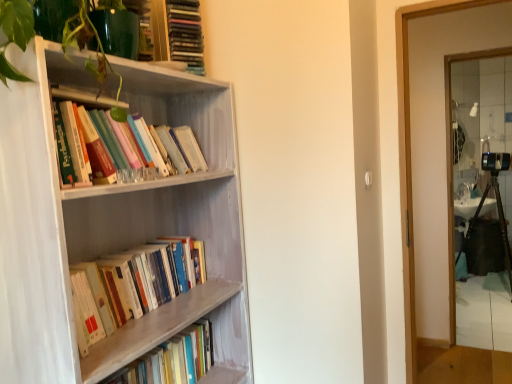
In order to face wooden bookshelf at left, marked as the 2th book in a bottom-to-top arrangement, should I rotate leftwards or rightwards?

Turn left by 15.346 degrees to look at wooden bookshelf at left, marked as the 2th book in a bottom-to-top arrangement.

This screenshot has width=512, height=384. I want to click on wooden bookshelf at left, marked as the 2th book in a bottom-to-top arrangement, so click(143, 279).

The height and width of the screenshot is (384, 512). Describe the element at coordinates (482, 196) in the screenshot. I see `clear glass mirror at right` at that location.

In order to face clear glass mirror at right, should I rotate leftwards or rightwards?

It's best to rotate right around 28.938 degrees.

Identify the location of wooden book at left, which is the 1th book from bottom to top. This screenshot has width=512, height=384. (172, 359).

This screenshot has height=384, width=512. What do you see at coordinates (136, 143) in the screenshot?
I see `hardcover books at upper left, which is the 3th book in bottom-to-top order` at bounding box center [136, 143].

This screenshot has height=384, width=512. Identify the location of matte plastic books at upper center, acting as the 4th book starting from the bottom. (185, 34).

The width and height of the screenshot is (512, 384). Identify the location of wooden bookshelf at left, marked as the 3th book in a top-to-bottom arrangement. (143, 279).

Can you confirm if wooden bookcase at left is wider than clear glass mirror at right?

Indeed, wooden bookcase at left has a greater width compared to clear glass mirror at right.

Is wooden bookcase at left taller than clear glass mirror at right?

In fact, wooden bookcase at left may be shorter than clear glass mirror at right.

Consider the image. Is wooden bookcase at left at the left side of clear glass mirror at right?

Correct, you'll find wooden bookcase at left to the left of clear glass mirror at right.

Does wooden bookcase at left contain clear glass mirror at right?

No, clear glass mirror at right is not inside wooden bookcase at left.

In terms of height, does matte plastic books at upper center, acting as the 4th book starting from the bottom, look taller or shorter compared to wooden bookshelf at left, marked as the 3th book in a top-to-bottom arrangement?

Considering their sizes, matte plastic books at upper center, acting as the 4th book starting from the bottom, has more height than wooden bookshelf at left, marked as the 3th book in a top-to-bottom arrangement.

Locate an element on the screen. The height and width of the screenshot is (384, 512). the 2nd book located above the wooden bookshelf at left, marked as the 2th book in a bottom-to-top arrangement (from a real-world perspective) is located at coordinates (185, 34).

Considering the positions of objects matte plastic books at upper center, acting as the 4th book starting from the bottom, and wooden bookshelf at left, marked as the 2th book in a bottom-to-top arrangement, in the image provided, who is in front, matte plastic books at upper center, acting as the 4th book starting from the bottom, or wooden bookshelf at left, marked as the 2th book in a bottom-to-top arrangement,?

wooden bookshelf at left, marked as the 2th book in a bottom-to-top arrangement.

How different are the orientations of matte plastic books at upper center, the 1th book viewed from the top, and wooden bookshelf at left, marked as the 2th book in a bottom-to-top arrangement, in degrees?

The facing directions of matte plastic books at upper center, the 1th book viewed from the top, and wooden bookshelf at left, marked as the 2th book in a bottom-to-top arrangement, are 28.1 degrees apart.

Which object is thinner, wooden book at left, which is the 1th book from bottom to top, or wooden bookshelf at left, marked as the 3th book in a top-to-bottom arrangement?

Thinner between the two is wooden book at left, which is the 1th book from bottom to top.

Is wooden book at left, which is the 1th book from bottom to top, bigger than wooden bookshelf at left, marked as the 3th book in a top-to-bottom arrangement?

No.

Is wooden book at left, the 4th book viewed from the top, completely or partially outside of wooden bookshelf at left, marked as the 3th book in a top-to-bottom arrangement?

wooden book at left, the 4th book viewed from the top, is positioned outside wooden bookshelf at left, marked as the 3th book in a top-to-bottom arrangement.

Does wooden bookshelf at left, marked as the 3th book in a top-to-bottom arrangement, appear on the right side of matte plastic books at upper center, the 1th book viewed from the top?

No.

Consider the image. Is wooden bookshelf at left, marked as the 3th book in a top-to-bottom arrangement, facing away from matte plastic books at upper center, the 1th book viewed from the top?

wooden bookshelf at left, marked as the 3th book in a top-to-bottom arrangement, is not turned away from matte plastic books at upper center, the 1th book viewed from the top.

How many degrees apart are the facing directions of wooden bookshelf at left, marked as the 2th book in a bottom-to-top arrangement, and matte plastic books at upper center, the 1th book viewed from the top?

28.1 degrees separate the facing orientations of wooden bookshelf at left, marked as the 2th book in a bottom-to-top arrangement, and matte plastic books at upper center, the 1th book viewed from the top.

Does point (183, 283) appear closer or farther from the camera than point (202, 62)?

Point (183, 283).

Considering the sizes of objects clear glass mirror at right and hardcover books at upper left, which is the 3th book in bottom-to-top order, in the image provided, who is bigger, clear glass mirror at right or hardcover books at upper left, which is the 3th book in bottom-to-top order,?

With larger size is clear glass mirror at right.

How many degrees apart are the facing directions of clear glass mirror at right and hardcover books at upper left, which is the second book from top to bottom?

87 degrees separate the facing orientations of clear glass mirror at right and hardcover books at upper left, which is the second book from top to bottom.

Is clear glass mirror at right turned away from hardcover books at upper left, which is the second book from top to bottom?

clear glass mirror at right is not turned away from hardcover books at upper left, which is the second book from top to bottom.

You are a GUI agent. You are given a task and a screenshot of the screen. Output one action in this format:
    pyautogui.click(x=<x>, y=<y>)
    Task: Click on the mirror behind the hardcover books at upper left, which is the second book from top to bottom
    
    Given the screenshot: What is the action you would take?
    pyautogui.click(x=482, y=196)

In the scene shown: Is wooden bookcase at left placed right next to green glossy plant at upper left?

No, wooden bookcase at left is not with green glossy plant at upper left.

Is wooden bookcase at left oriented towards green glossy plant at upper left?

No, wooden bookcase at left does not turn towards green glossy plant at upper left.

In the scene shown: Is green glossy plant at upper left inside wooden bookcase at left?

Actually, green glossy plant at upper left is outside wooden bookcase at left.

What are the coordinates of `plant in front of the wooden bookcase at left` in the screenshot? It's located at (96, 53).

Between hardcover books at upper left, which is the 3th book in bottom-to-top order, and wooden bookshelf at left, marked as the 2th book in a bottom-to-top arrangement, which one has less height?

wooden bookshelf at left, marked as the 2th book in a bottom-to-top arrangement, is shorter.

Is hardcover books at upper left, which is the second book from top to bottom, bigger than wooden bookshelf at left, marked as the 2th book in a bottom-to-top arrangement?

Correct, hardcover books at upper left, which is the second book from top to bottom, is larger in size than wooden bookshelf at left, marked as the 2th book in a bottom-to-top arrangement.

How many degrees apart are the facing directions of hardcover books at upper left, which is the 3th book in bottom-to-top order, and wooden bookshelf at left, marked as the 2th book in a bottom-to-top arrangement?

The facing directions of hardcover books at upper left, which is the 3th book in bottom-to-top order, and wooden bookshelf at left, marked as the 2th book in a bottom-to-top arrangement, are 0.000535 degrees apart.

From a real-world perspective, is hardcover books at upper left, which is the second book from top to bottom, above or below wooden bookshelf at left, marked as the 2th book in a bottom-to-top arrangement?

hardcover books at upper left, which is the second book from top to bottom, is above wooden bookshelf at left, marked as the 2th book in a bottom-to-top arrangement.

Find the location of a particular element. This screenshot has width=512, height=384. mirror on the right of wooden bookcase at left is located at coordinates (482, 196).

Where is `the 2nd book in front of the matte plastic books at upper center, acting as the 4th book starting from the bottom`? The height and width of the screenshot is (384, 512). the 2nd book in front of the matte plastic books at upper center, acting as the 4th book starting from the bottom is located at coordinates (143, 279).

Considering their positions, is wooden bookcase at left positioned closer to matte plastic books at upper center, the 1th book viewed from the top, than clear glass mirror at right?

The object closer to matte plastic books at upper center, the 1th book viewed from the top, is wooden bookcase at left.

Based on their spatial positions, is wooden bookshelf at left, marked as the 2th book in a bottom-to-top arrangement, or wooden bookcase at left closer to hardcover books at upper left, which is the second book from top to bottom?

wooden bookcase at left.

Estimate the real-world distances between objects in this image. Which object is closer to wooden bookshelf at left, marked as the 3th book in a top-to-bottom arrangement, hardcover books at upper left, which is the second book from top to bottom, or matte plastic books at upper center, the 1th book viewed from the top?

hardcover books at upper left, which is the second book from top to bottom.

Looking at the image, which one is located further to hardcover books at upper left, which is the second book from top to bottom, wooden book at left, which is the 1th book from bottom to top, or matte plastic books at upper center, the 1th book viewed from the top?

Based on the image, wooden book at left, which is the 1th book from bottom to top, appears to be further to hardcover books at upper left, which is the second book from top to bottom.

Looking at the image, which one is located further to matte plastic books at upper center, acting as the 4th book starting from the bottom, wooden book at left, which is the 1th book from bottom to top, or wooden bookshelf at left, marked as the 2th book in a bottom-to-top arrangement?

wooden book at left, which is the 1th book from bottom to top, is further to matte plastic books at upper center, acting as the 4th book starting from the bottom.

Looking at the image, which one is located further to green glossy plant at upper left, wooden bookshelf at left, marked as the 3th book in a top-to-bottom arrangement, or wooden book at left, which is the 1th book from bottom to top?

wooden book at left, which is the 1th book from bottom to top.

Based on their spatial positions, is wooden book at left, which is the 1th book from bottom to top, or green glossy plant at upper left closer to clear glass mirror at right?

Among the two, wooden book at left, which is the 1th book from bottom to top, is located nearer to clear glass mirror at right.

Based on their spatial positions, is hardcover books at upper left, which is the second book from top to bottom, or wooden book at left, the 4th book viewed from the top, further from wooden bookshelf at left, marked as the 3th book in a top-to-bottom arrangement?

Based on the image, hardcover books at upper left, which is the second book from top to bottom, appears to be further to wooden bookshelf at left, marked as the 3th book in a top-to-bottom arrangement.

Locate an element on the screen. book that lies between matte plastic books at upper center, acting as the 4th book starting from the bottom, and wooden bookcase at left from top to bottom is located at coordinates (136, 143).

Where is `book between wooden bookcase at left and wooden book at left, which is the 1th book from bottom to top, from top to bottom`? This screenshot has width=512, height=384. book between wooden bookcase at left and wooden book at left, which is the 1th book from bottom to top, from top to bottom is located at coordinates (x=143, y=279).

At what (x,y) coordinates should I click in order to perform the action: click on plant between matte plastic books at upper center, acting as the 4th book starting from the bottom, and wooden book at left, the 4th book viewed from the top, vertically. Please return your answer as a coordinate pair (x, y). The height and width of the screenshot is (384, 512). Looking at the image, I should click on (96, 53).

Find the location of `book located between wooden bookcase at left and clear glass mirror at right in the left-right direction`. book located between wooden bookcase at left and clear glass mirror at right in the left-right direction is located at coordinates (185, 34).